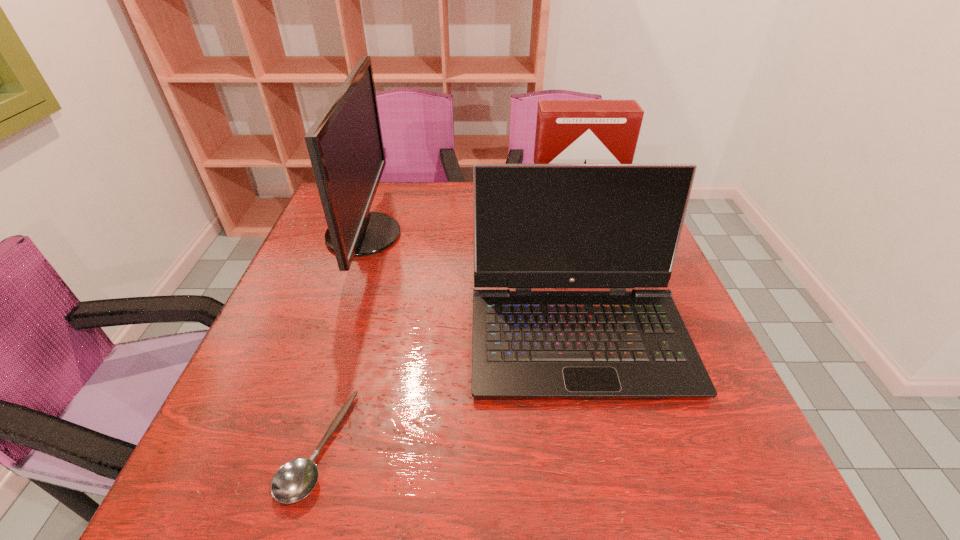
This screenshot has width=960, height=540. In order to click on object at the near edge in this screenshot , I will do `click(294, 480)`.

Locate an element on the screen. monitor present at the left edge is located at coordinates (345, 145).

Locate an element on the screen. ladle that is at the left edge is located at coordinates (294, 480).

Locate an element on the screen. cigarette_case at the right edge is located at coordinates (567, 131).

The height and width of the screenshot is (540, 960). In order to click on laptop computer that is at the right edge in this screenshot , I will do `click(617, 226)`.

Locate an element on the screen. This screenshot has height=540, width=960. object at the far left corner is located at coordinates (345, 145).

Locate an element on the screen. The image size is (960, 540). object positioned at the near left corner is located at coordinates (294, 480).

Where is `object that is at the far right corner`? The height and width of the screenshot is (540, 960). object that is at the far right corner is located at coordinates (567, 131).

Where is `vacant area at the far edge`? This screenshot has height=540, width=960. vacant area at the far edge is located at coordinates (412, 185).

Locate an element on the screen. vacant region at the near edge is located at coordinates (607, 471).